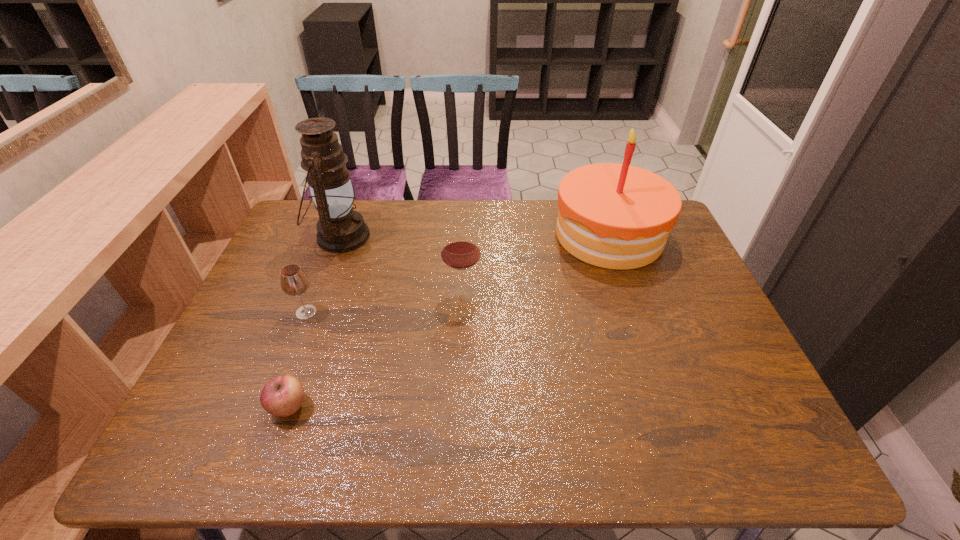
Where is `object that is positioned at the far right corner`? This screenshot has height=540, width=960. object that is positioned at the far right corner is located at coordinates (616, 216).

This screenshot has height=540, width=960. In the image, there is a desktop. Find the location of `vacant area at the far edge`. vacant area at the far edge is located at coordinates (423, 218).

Locate an element on the screen. vacant area at the near edge of the desktop is located at coordinates (426, 426).

The image size is (960, 540). I want to click on free spot at the left edge of the desktop, so click(x=274, y=272).

You are a GUI agent. You are given a task and a screenshot of the screen. Output one action in this format:
    pyautogui.click(x=<x>, y=<y>)
    Task: Click on the vacant space at the right edge of the desktop
    Image resolution: width=960 pixels, height=540 pixels.
    Given the screenshot: What is the action you would take?
    pyautogui.click(x=727, y=417)

Image resolution: width=960 pixels, height=540 pixels. Find the location of `empty location between the right wineglass and the rightmost object`. empty location between the right wineglass and the rightmost object is located at coordinates (536, 265).

The image size is (960, 540). Find the location of `empty space between the oil lamp and the nearest object`. empty space between the oil lamp and the nearest object is located at coordinates (315, 322).

What are the coordinates of `empty space that is in between the third tallest object and the left wineglass` in the screenshot? It's located at (384, 303).

The height and width of the screenshot is (540, 960). What are the coordinates of `free spot between the birthday cake and the taller wineglass` in the screenshot? It's located at (536, 265).

Identify the location of free space between the third shortest object and the second shortest object. (384, 303).